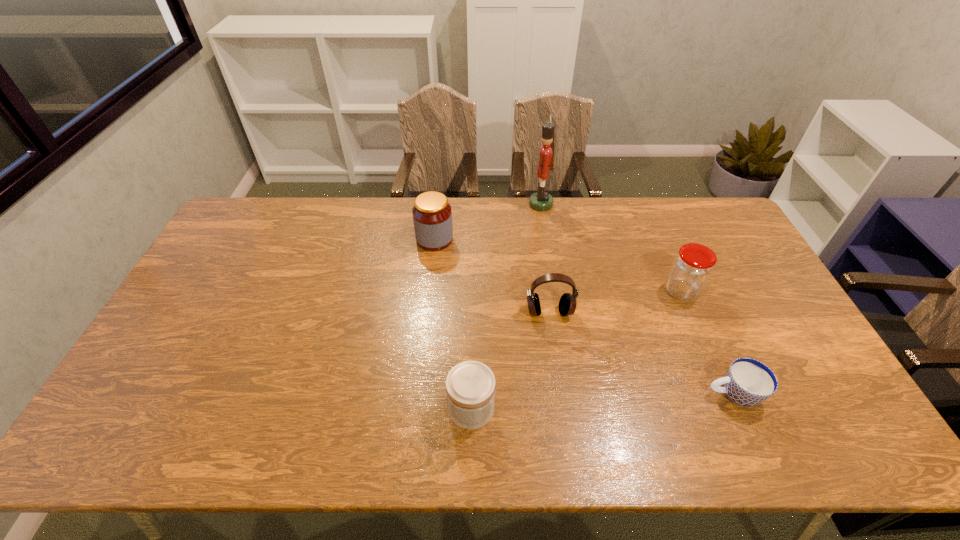
At what (x,y) coordinates should I click in order to perform the action: click on the tallest object. Please return your answer as a coordinate pair (x, y). Looking at the image, I should click on (540, 201).

You are a GUI agent. You are given a task and a screenshot of the screen. Output one action in this format:
    pyautogui.click(x=<x>, y=<y>)
    Task: Click on the nutcracker
    The height and width of the screenshot is (540, 960).
    Given the screenshot: What is the action you would take?
    pyautogui.click(x=540, y=201)

Where is `the leftmost object`? the leftmost object is located at coordinates (432, 215).

You are a GUI agent. You are given a task and a screenshot of the screen. Output one action in this format:
    pyautogui.click(x=<x>, y=<y>)
    Task: Click on the farthest jar
    The height and width of the screenshot is (540, 960).
    Given the screenshot: What is the action you would take?
    pyautogui.click(x=432, y=215)

This screenshot has height=540, width=960. I want to click on the rightmost jar, so click(x=692, y=267).

The width and height of the screenshot is (960, 540). In order to click on headset in this screenshot , I will do `click(567, 305)`.

This screenshot has height=540, width=960. In order to click on the nearest jar in this screenshot , I will do (x=470, y=385).

Find the location of a particular element. the second shortest object is located at coordinates (470, 385).

Locate an element on the screen. the shortest object is located at coordinates (748, 382).

Locate an element on the screen. The image size is (960, 540). vacant region located 0.310m on the front-facing side of the tallest object is located at coordinates (447, 204).